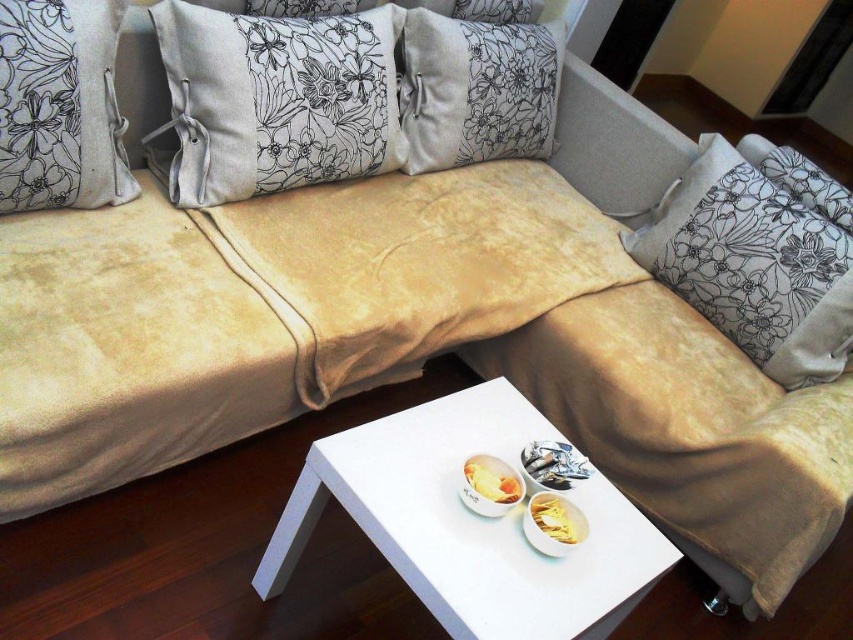
You are planning to place a rectangular tray that is 1.2 meters long on the white glossy table at center. Considering the velvet floral pillow at center is already on the table, will the tray fit entirely on the table without hanging over the edges?

The white glossy table at center has a larger width than the velvet floral pillow at center. However, the exact dimensions of the table are not provided. Since the tray is 1.2 meters long, we cannot confirm if it will fit without knowing the table dimensions. Please provide more details about the table size.

You are standing in the living room and want to place a 1.2 meter long decorative item on the white glossy table at center. Can you fit it on the table without moving any existing items?

The white glossy table at center is only 1.08 meters away from the viewer, so the 1.2 meter long decorative item may not fit properly as it is longer than the table.